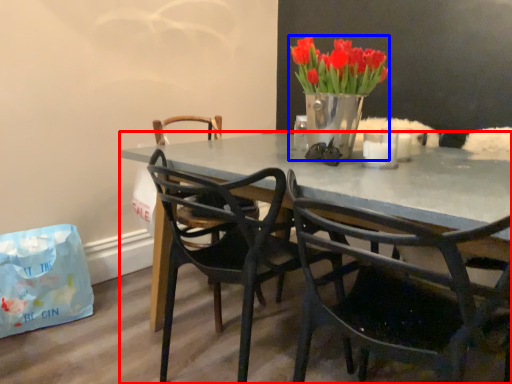
Question: Which object is further to the camera taking this photo, desk (highlighted by a red box) or houseplant (highlighted by a blue box)?

Choices:
 (A) desk
 (B) houseplant

Answer: (B)